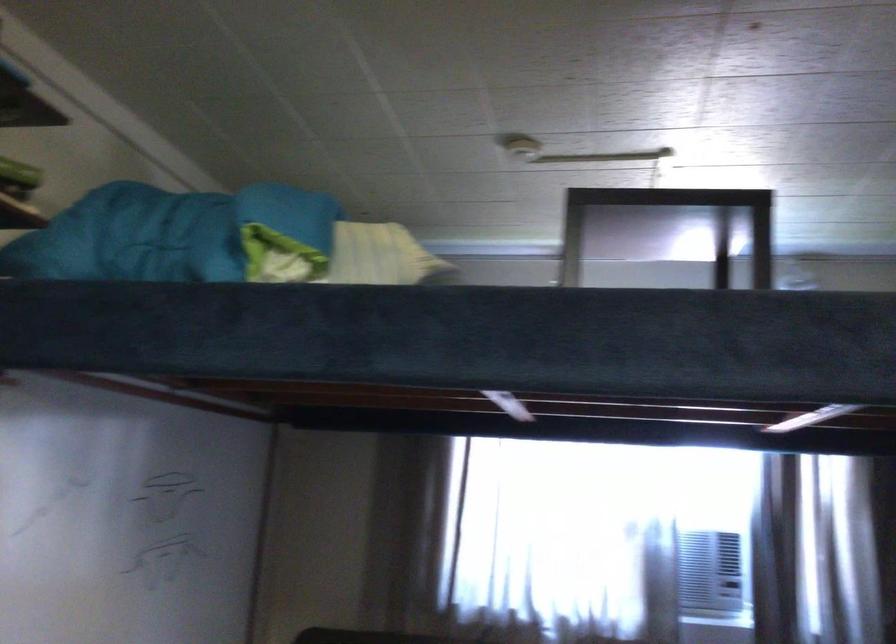
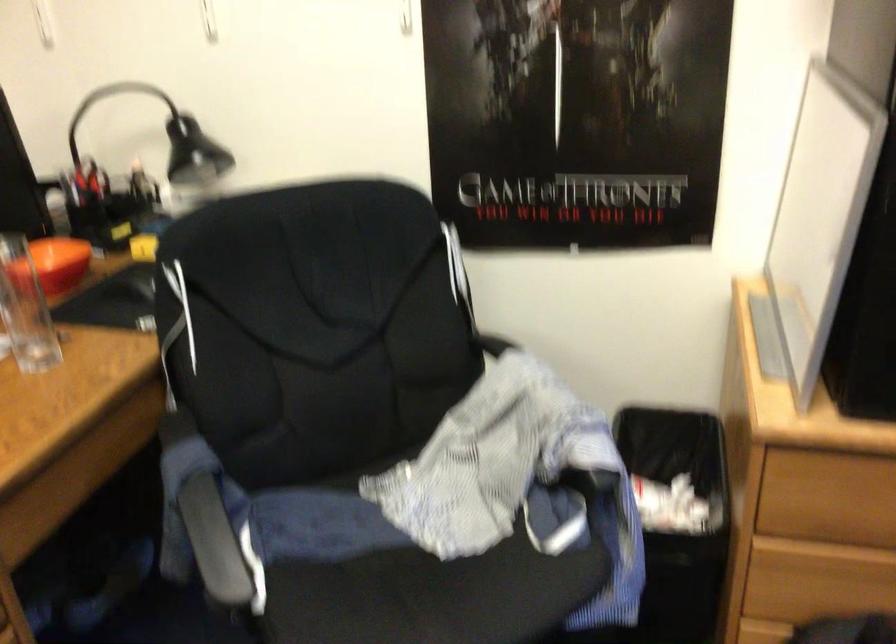
The images are taken continuously from a first-person perspective. In which direction is your viewpoint rotating?

The camera rotated toward left-down.